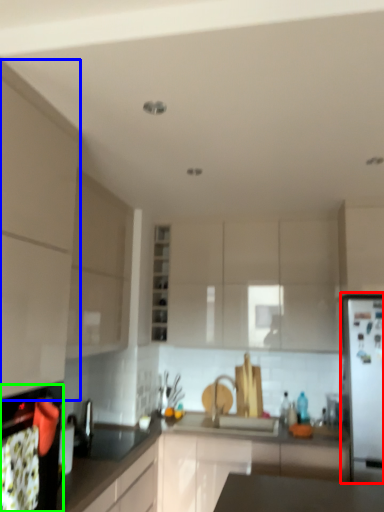
Question: Estimate the real-world distances between objects in this image. Which object is closer to fridge (highlighted by a red box), cabinetry (highlighted by a blue box) or oven (highlighted by a green box)?

Choices:
 (A) cabinetry
 (B) oven

Answer: (B)